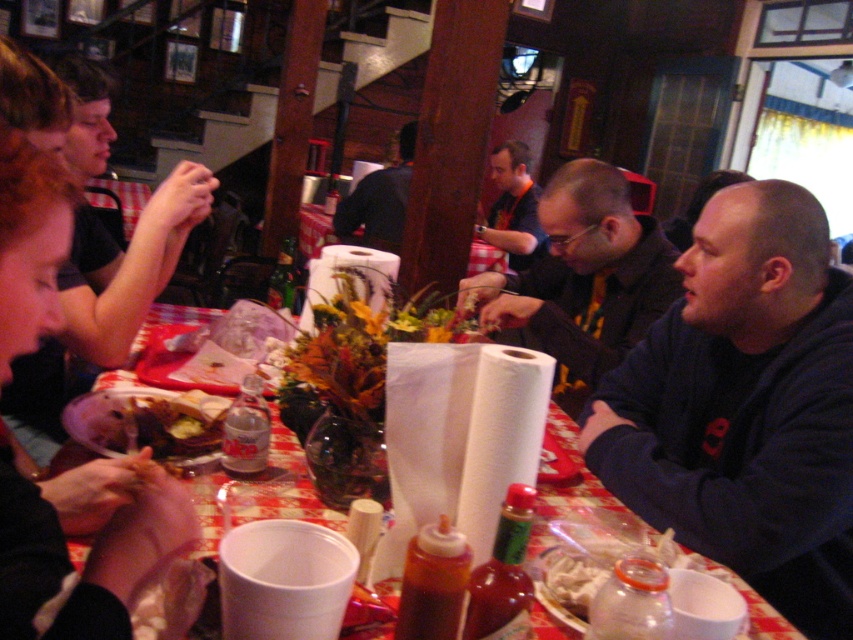
Question: Does dark blue sweatshirt at right have a smaller size compared to dark blue shirt at center?

Choices:
 (A) yes
 (B) no

Answer: (A)

Question: Among these points, which one is farthest from the camera?

Choices:
 (A) (350, 221)
 (B) (173, 547)
 (C) (653, 340)

Answer: (A)

Question: Can you confirm if smooth black hair at upper left is positioned below matte black shirt at center?

Choices:
 (A) yes
 (B) no

Answer: (A)

Question: Among these objects, which one is nearest to the camera?

Choices:
 (A) dark blue sweatshirt at right
 (B) dark brown bread at table center

Answer: (A)

Question: Which is nearer to the dark brown bread at table center?

Choices:
 (A) dark blue sweatshirt at right
 (B) smooth black hair at upper left

Answer: (B)

Question: From the image, what is the correct spatial relationship of red checkered tablecloth at center in relation to dark blue shirt at center?

Choices:
 (A) right
 (B) left

Answer: (B)